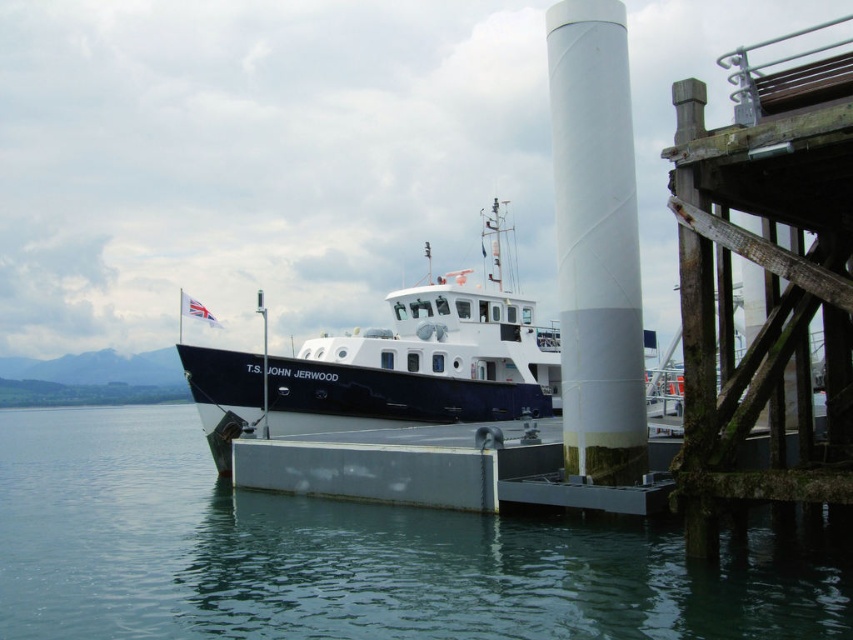
You are standing on the pier and want to check the water level at point (x=349, y=556). What do you see there?

At point (x=349, y=556), there is clear water at lower center.

You are a dock worker trying to secure the white glossy boat at center to the white textured pipe at center. Given their sizes, will you need an extension rope to reach from the boat to the pipe?

The white glossy boat at center is larger than the white textured pipe at center, so you will need an extension rope to reach from the boat to the pipe.